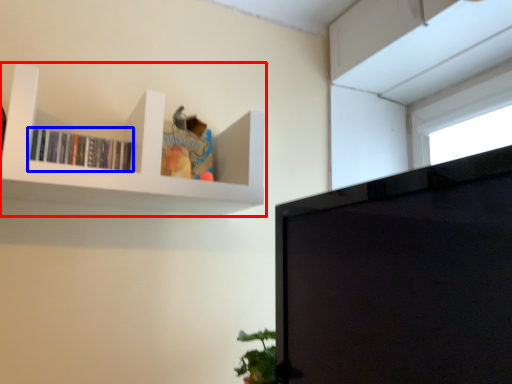
Question: Which object appears closest to the camera in this image, shelf (highlighted by a red box) or book (highlighted by a blue box)?

Choices:
 (A) shelf
 (B) book

Answer: (A)